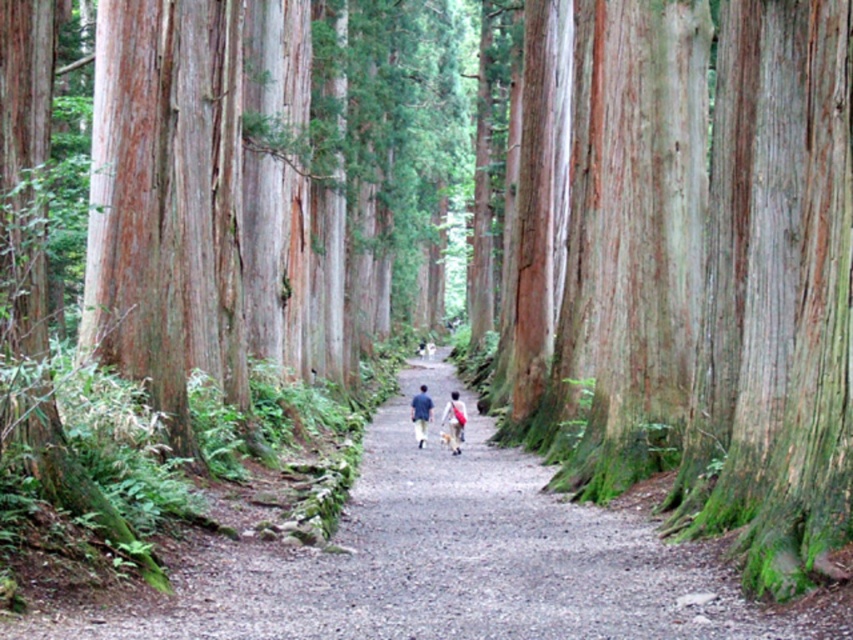
You are a hiker standing on the dirt path at center and looking towards the blue fabric person at center. Which object is higher in elevation?

The blue fabric person at center is higher in elevation than the dirt path at center because the dirt path at center has a lesser height compared to blue fabric person at center.

You are a hiker who has lost a light blue fabric at center in the forest. Based on the scene, where would you most likely find it?

The light blue fabric at center is located at point (453, 420) in the scene.

You are a hiker carrying a large backpack and need to walk along the dirt path at center while avoiding the blue fabric person at center. Is there enough space for you to pass safely?

The dirt path at center is larger in size than blue fabric person at center, so yes, there is enough space to pass safely as the path is wider than the person.